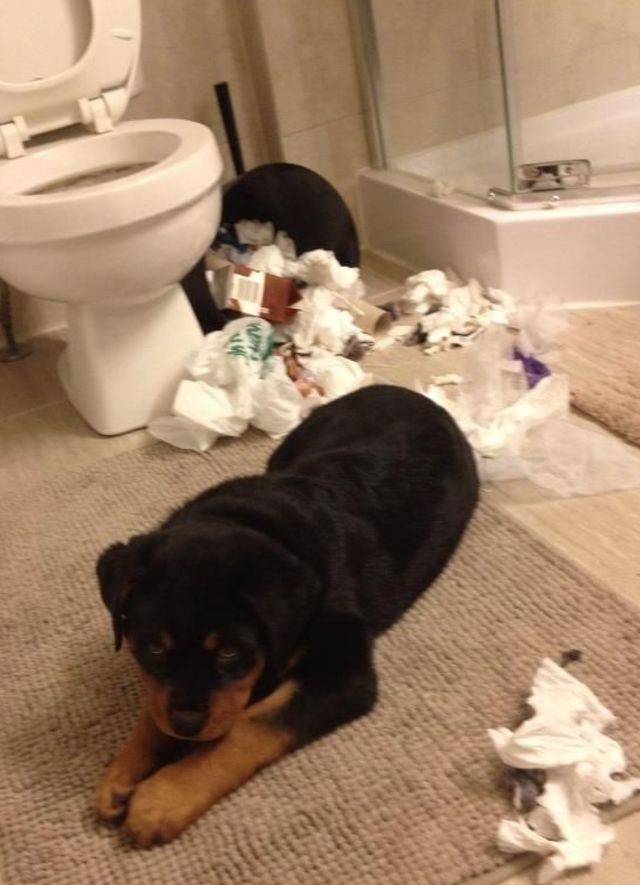
The image size is (640, 885). I want to click on rug, so click(x=401, y=772).